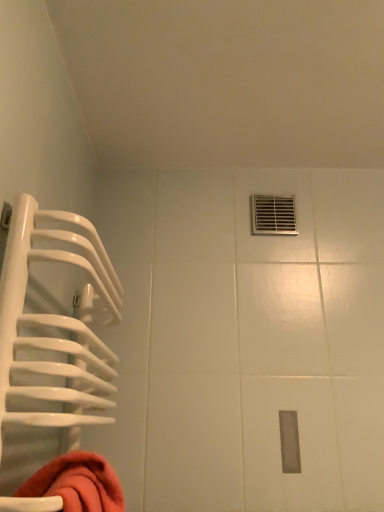
Describe the element at coordinates (51, 348) in the screenshot. This screenshot has height=512, width=384. I see `white glossy towel rack at left` at that location.

Identify the location of white glossy towel rack at left. (51, 348).

The height and width of the screenshot is (512, 384). What are the coordinates of `metallic vent at upper right` in the screenshot? It's located at (273, 215).

What do you see at coordinates (273, 215) in the screenshot? This screenshot has width=384, height=512. I see `metallic vent at upper right` at bounding box center [273, 215].

What is the approximate height of metallic vent at upper right?

metallic vent at upper right is 6.05 inches in height.

Where is `white glossy towel rack at left`? The width and height of the screenshot is (384, 512). white glossy towel rack at left is located at coordinates (51, 348).

Would you say white glossy towel rack at left is to the left or to the right of metallic vent at upper right in the picture?

Based on their positions, white glossy towel rack at left is located to the left of metallic vent at upper right.

Is the position of white glossy towel rack at left more distant than that of metallic vent at upper right?

No, it is in front of metallic vent at upper right.

In the scene shown: Which is nearer, [41,214] or [275,200]?

The point [41,214] is in front.

From the image's perspective, relative to metallic vent at upper right, is white glossy towel rack at left above or below?

Based on their image positions, white glossy towel rack at left is located beneath metallic vent at upper right.

From a real-world perspective, between white glossy towel rack at left and metallic vent at upper right, who is vertically lower?

In real-world perspective, white glossy towel rack at left is lower.

Which object is thinner, white glossy towel rack at left or metallic vent at upper right?

metallic vent at upper right is thinner.

From the picture: Does white glossy towel rack at left have a lesser height compared to metallic vent at upper right?

No.

Based on the photo, considering the sizes of objects white glossy towel rack at left and metallic vent at upper right in the image provided, who is bigger, white glossy towel rack at left or metallic vent at upper right?

white glossy towel rack at left.

Is white glossy towel rack at left not within metallic vent at upper right?

Yes, white glossy towel rack at left is not within metallic vent at upper right.

Is white glossy towel rack at left positioned far away from metallic vent at upper right?

Actually, white glossy towel rack at left and metallic vent at upper right are a little close together.

Is white glossy towel rack at left looking in the opposite direction of metallic vent at upper right?

No.

What's the angular difference between white glossy towel rack at left and metallic vent at upper right's facing directions?

There is a 90.4-degree angle between the facing directions of white glossy towel rack at left and metallic vent at upper right.

In order to click on hole behind the white glossy towel rack at left in this screenshot , I will do `click(273, 215)`.

Considering the relative positions of metallic vent at upper right and white glossy towel rack at left in the image provided, is metallic vent at upper right to the left or to the right of white glossy towel rack at left?

metallic vent at upper right is positioned on white glossy towel rack at left's right side.

Is metallic vent at upper right positioned before white glossy towel rack at left?

No.

In the scene shown: Which is farther, (270, 196) or (94, 272)?

Positioned behind is point (270, 196).

From the image's perspective, which object appears higher, metallic vent at upper right or white glossy towel rack at left?

From the image's view, metallic vent at upper right is above.

From a real-world perspective, does metallic vent at upper right sit lower than white glossy towel rack at left?

Incorrect, from a real-world perspective, metallic vent at upper right is higher than white glossy towel rack at left.

Between metallic vent at upper right and white glossy towel rack at left, which one has smaller width?

metallic vent at upper right is thinner.

Can you confirm if metallic vent at upper right is shorter than white glossy towel rack at left?

Indeed, metallic vent at upper right has a lesser height compared to white glossy towel rack at left.

Between metallic vent at upper right and white glossy towel rack at left, which one has smaller size?

With smaller size is metallic vent at upper right.

Is metallic vent at upper right completely or partially outside of white glossy towel rack at left?

Yes, metallic vent at upper right is not within white glossy towel rack at left.

Is metallic vent at upper right placed right next to white glossy towel rack at left?

No, metallic vent at upper right is not with white glossy towel rack at left.

Is metallic vent at upper right positioned with its back to white glossy towel rack at left?

metallic vent at upper right does not have its back to white glossy towel rack at left.

Identify the location of hole positioned vertically above the white glossy towel rack at left (from a real-world perspective). This screenshot has width=384, height=512. (273, 215).

You are a GUI agent. You are given a task and a screenshot of the screen. Output one action in this format:
    pyautogui.click(x=<x>, y=<y>)
    Task: Click on the cage located in front of the metallic vent at upper right
    The image size is (384, 512).
    Given the screenshot: What is the action you would take?
    pyautogui.click(x=51, y=348)

I want to click on cage directly beneath the metallic vent at upper right (from a real-world perspective), so click(x=51, y=348).